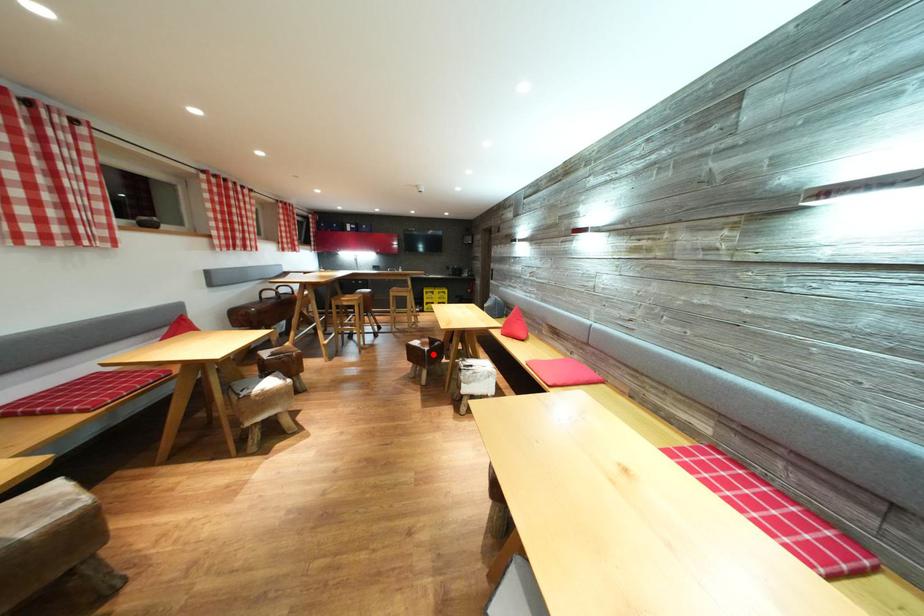
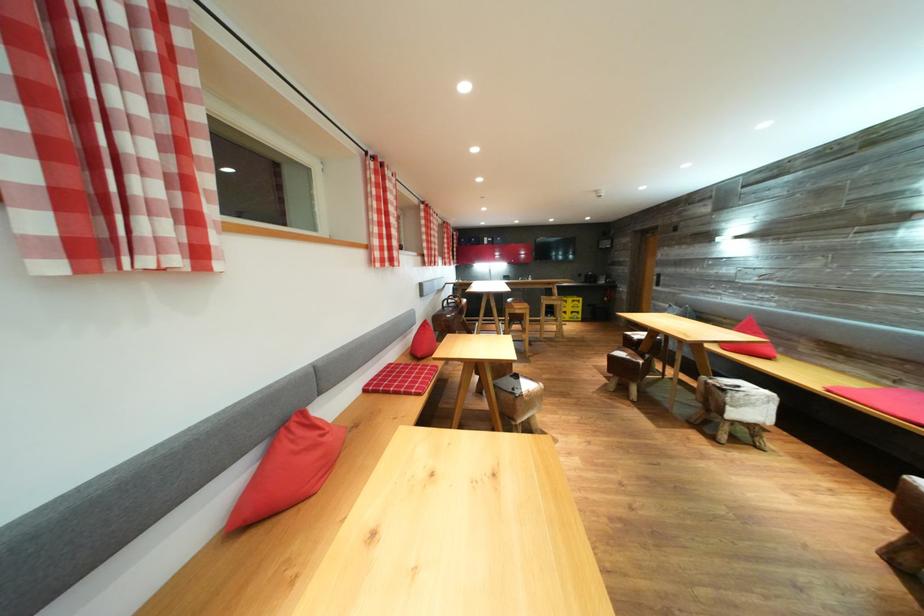
The point at the highlighted location is marked in the first image. Where is the corresponding point in the second image?

(648, 367)